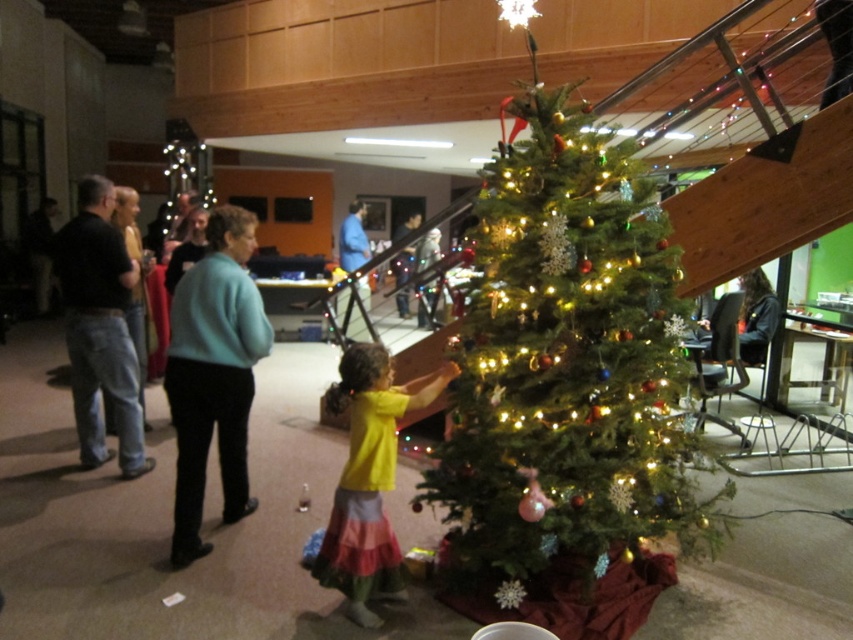
You are at a community event and see two people on the left side of the room. One is wearing jeans at left and the other is wearing a light blue sweater at left. Which clothing item is positioned more to the right side?

The jeans at left are positioned more to the right side than the light blue sweater at left.

You are standing in the festive indoor scene with the decorated Christmas tree. You need to place a gift box at the exact location of the jeans at left. Where should you place the gift box?

You should place the gift box at the 2D location point of jeans at left, which is at point (100, 328).

You are a photographer at the event and want to capture a full view of both the green matte christmas tree at center and the yellow matte shirt at center in a single photo. Given the height difference between them, will you need to adjust your camera angle to ensure both are fully visible?

The green matte christmas tree at center is much taller than the yellow matte shirt at center. To capture both fully, you should position the camera slightly lower to include the full height of the tree while still framing the shirt appropriately.